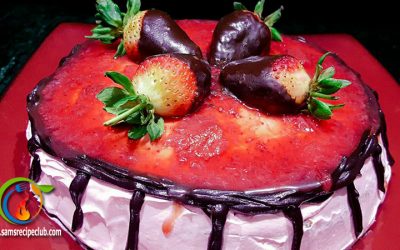
Locate an element on the screen. Image resolution: width=400 pixels, height=250 pixels. table is located at coordinates (384, 80).